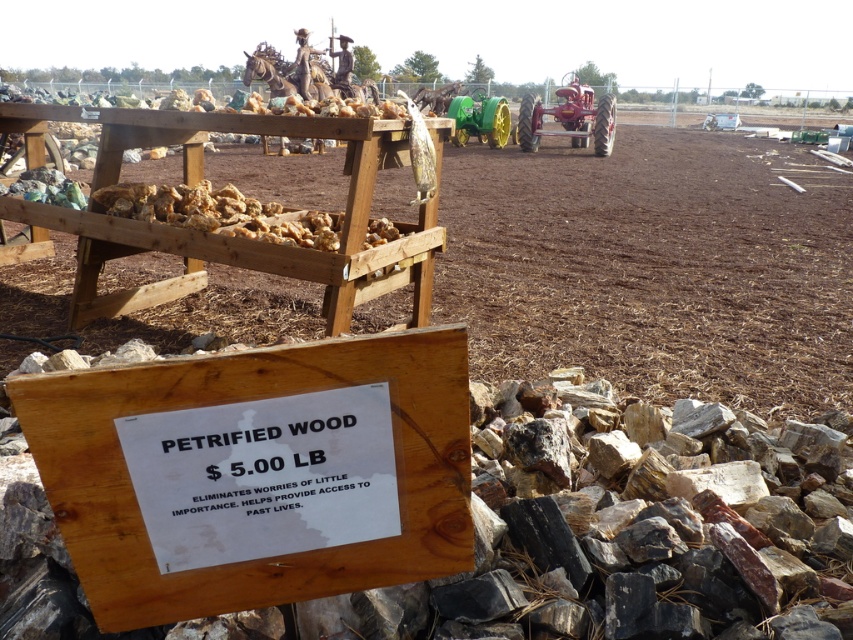
Can you confirm if red metal tractor at center is positioned to the right of green rubber tractor at center?

Correct, you'll find red metal tractor at center to the right of green rubber tractor at center.

Is red metal tractor at center taller than green rubber tractor at center?

Yes.

Is point (525, 132) farther from camera compared to point (476, 134)?

No, (525, 132) is closer to viewer.

I want to click on red metal tractor at center, so click(x=569, y=116).

Is point (457, 410) positioned behind point (460, 145)?

No, (457, 410) is in front of (460, 145).

From the picture: Does wooden sign at lower center have a greater height compared to green rubber tractor at center?

No, wooden sign at lower center is not taller than green rubber tractor at center.

Does point (299, 540) come in front of point (495, 138)?

That is True.

Locate an element on the screen. wooden sign at lower center is located at coordinates (256, 472).

Can you confirm if wooden sign at lower center is taller than red metal tractor at center?

No.

Which is more to the right, wooden sign at lower center or red metal tractor at center?

red metal tractor at center is more to the right.

Identify the location of wooden sign at lower center. (256, 472).

Find the location of a particular element. The width and height of the screenshot is (853, 640). wooden sign at lower center is located at coordinates (256, 472).